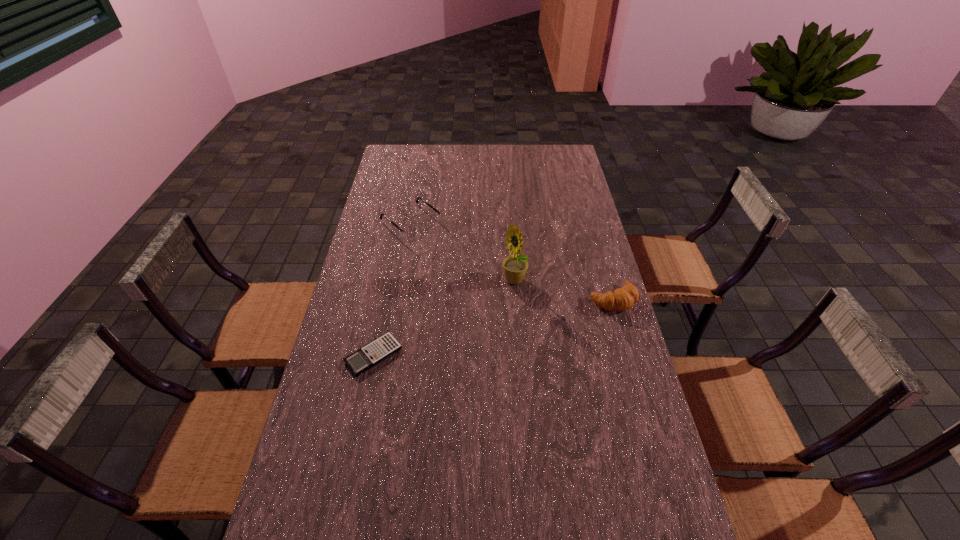
You are a GUI agent. You are given a task and a screenshot of the screen. Output one action in this format:
    pyautogui.click(x=<x>, y=<y>)
    Task: Click on the vacant area between the calculator and the crescent roll
    
    Given the screenshot: What is the action you would take?
    pyautogui.click(x=493, y=327)

This screenshot has height=540, width=960. Find the location of `free space that is in between the shortest object and the farthest object`. free space that is in between the shortest object and the farthest object is located at coordinates (393, 289).

Choose which object is the second nearest neighbor to the calculator. Please provide its 2D coordinates. Your answer should be formatted as a tuple, i.e. [(x, y)], where the tuple contains the x and y coordinates of a point satisfying the conditions above.

[(410, 232)]

Select which object appears as the third closest to the shortest object. Please provide its 2D coordinates. Your answer should be formatted as a tuple, i.e. [(x, y)], where the tuple contains the x and y coordinates of a point satisfying the conditions above.

[(624, 298)]

Where is `vacant space that satisfies the following two spatial constraints: 1. on the back side of the second object from right to left; 2. on the right side of the calculator`? vacant space that satisfies the following two spatial constraints: 1. on the back side of the second object from right to left; 2. on the right side of the calculator is located at coordinates (389, 281).

Find the location of `vacant space that satisfies the following two spatial constraints: 1. on the front side of the rightmost object; 2. on the left side of the spectacles`. vacant space that satisfies the following two spatial constraints: 1. on the front side of the rightmost object; 2. on the left side of the spectacles is located at coordinates (397, 299).

The image size is (960, 540). Find the location of `free space that satisfies the following two spatial constraints: 1. on the back side of the tallest object; 2. on the left side of the shortest object`. free space that satisfies the following two spatial constraints: 1. on the back side of the tallest object; 2. on the left side of the shortest object is located at coordinates (389, 281).

Where is `free space that satisfies the following two spatial constraints: 1. on the front side of the crescent roll; 2. on the right side of the sunflower`? free space that satisfies the following two spatial constraints: 1. on the front side of the crescent roll; 2. on the right side of the sunflower is located at coordinates tap(516, 299).

Find the location of a particular element. vacant position in the image that satisfies the following two spatial constraints: 1. on the front side of the farthest object; 2. on the right side of the second object from right to left is located at coordinates (400, 281).

This screenshot has height=540, width=960. I want to click on vacant space that satisfies the following two spatial constraints: 1. on the back side of the shortest object; 2. on the left side of the sunflower, so click(x=389, y=281).